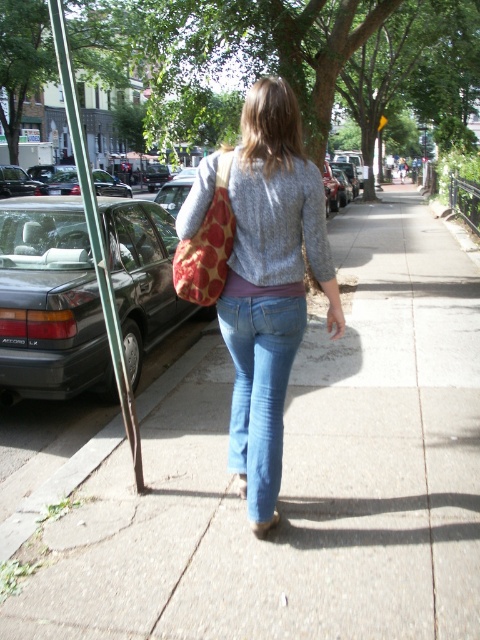
Question: Does dark gray metallic sedan at left have a smaller size compared to denim at center?

Choices:
 (A) yes
 (B) no

Answer: (B)

Question: Which object appears farthest from the camera in this image?

Choices:
 (A) green wood pole at left
 (B) matte concrete sidewalk at center
 (C) dark gray metallic sedan at left

Answer: (C)

Question: Which of the following is the closest to the observer?

Choices:
 (A) green wood pole at left
 (B) gray knitted sweater at center
 (C) matte concrete sidewalk at center
 (D) denim at center

Answer: (C)

Question: Is matte concrete sidewalk at center smaller than denim at center?

Choices:
 (A) yes
 (B) no

Answer: (B)

Question: Which is nearer to the dark gray metallic sedan at left?

Choices:
 (A) green wood pole at left
 (B) matte concrete sidewalk at center
 (C) gray knitted sweater at center
 (D) denim at center

Answer: (A)

Question: Is denim jeans at center behind denim at center?

Choices:
 (A) yes
 (B) no

Answer: (B)